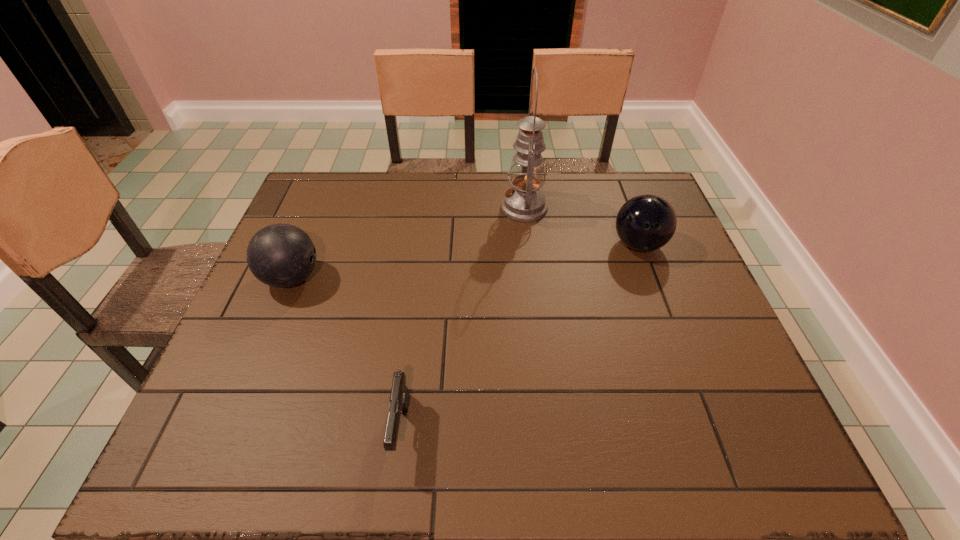
The width and height of the screenshot is (960, 540). In order to click on the second object from right to left in this screenshot , I will do `click(525, 203)`.

This screenshot has height=540, width=960. Identify the location of oil lamp. (525, 203).

This screenshot has height=540, width=960. Find the location of `the left bowling ball`. the left bowling ball is located at coordinates (280, 255).

You are a GUI agent. You are given a task and a screenshot of the screen. Output one action in this format:
    pyautogui.click(x=<x>, y=<y>)
    Task: Click on the rightmost object
    
    Given the screenshot: What is the action you would take?
    pyautogui.click(x=647, y=222)

Find the location of a particular element. The height and width of the screenshot is (540, 960). pistol is located at coordinates (399, 397).

The image size is (960, 540). I want to click on the shortest object, so click(x=399, y=397).

This screenshot has width=960, height=540. I want to click on vacant space located on the left of the third object from left to right, so click(x=432, y=208).

Where is `vacant point located 0.340m on the grip area of the leftmost object`? The height and width of the screenshot is (540, 960). vacant point located 0.340m on the grip area of the leftmost object is located at coordinates (455, 278).

This screenshot has width=960, height=540. Find the location of `vacant space located on the side of the right bowling ball with the finger holes`. vacant space located on the side of the right bowling ball with the finger holes is located at coordinates (688, 380).

Find the location of a particular element. object located at the far edge is located at coordinates (525, 203).